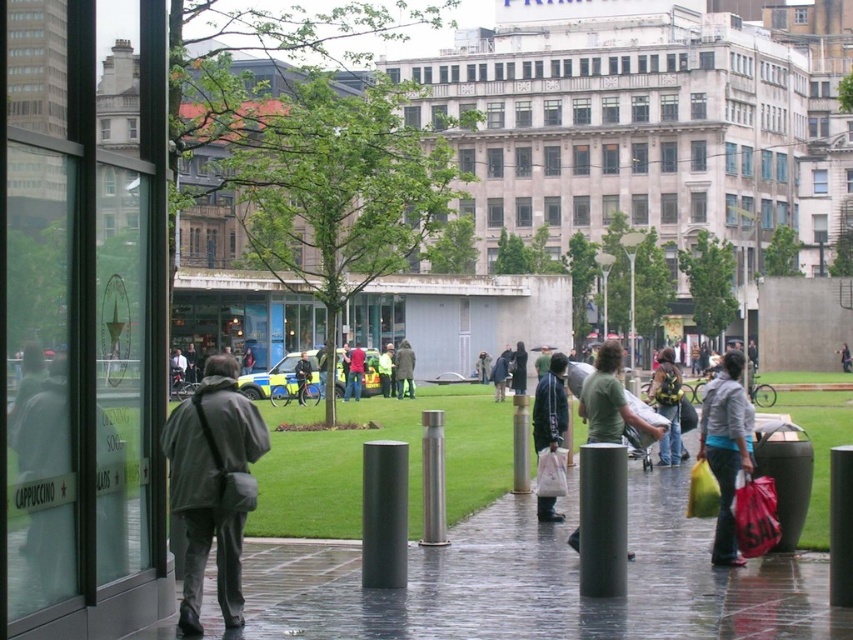
Can you confirm if smooth black pole at center is positioned above dark gray jacket at center?

No.

Find the location of a particular element. Image resolution: width=853 pixels, height=640 pixels. smooth black pole at center is located at coordinates (384, 515).

Is point (215, 538) positioned before point (349, 372)?

Yes, it is in front of point (349, 372).

Does dark gray fabric jacket at left appear over red fabric jacket at center?

No, dark gray fabric jacket at left is not above red fabric jacket at center.

Find the location of a particular element. dark gray fabric jacket at left is located at coordinates (213, 484).

Which of these two, denim jacket at lower right or smooth black pole at center, stands taller?

With more height is denim jacket at lower right.

The image size is (853, 640). What do you see at coordinates (726, 449) in the screenshot?
I see `denim jacket at lower right` at bounding box center [726, 449].

The image size is (853, 640). In order to click on denim jacket at lower right in this screenshot , I will do `click(726, 449)`.